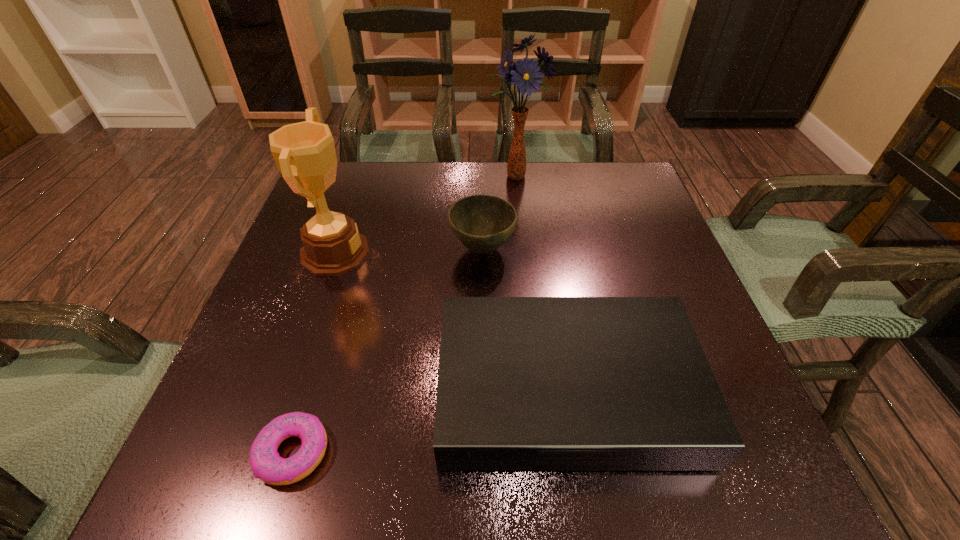
Image resolution: width=960 pixels, height=540 pixels. In order to click on object that is at the far edge in this screenshot , I will do `click(525, 74)`.

Image resolution: width=960 pixels, height=540 pixels. In order to click on CD player situated at the near edge in this screenshot , I will do `click(525, 383)`.

The image size is (960, 540). Find the location of `doughnut present at the near edge`. doughnut present at the near edge is located at coordinates (265, 462).

Identify the location of award positioned at the left edge. The image size is (960, 540). (304, 152).

Identify the location of doughnut at the left edge. (265, 462).

Locate an element on the screen. Image resolution: width=960 pixels, height=540 pixels. object that is positioned at the right edge is located at coordinates (525, 383).

This screenshot has height=540, width=960. I want to click on object located at the near left corner, so click(x=265, y=462).

Identify the location of object that is at the near right corner. The height and width of the screenshot is (540, 960). (525, 383).

This screenshot has height=540, width=960. I want to click on free space at the far edge of the desktop, so click(398, 197).

In the image, there is a desktop. In order to click on free space at the near edge in this screenshot , I will do `click(375, 470)`.